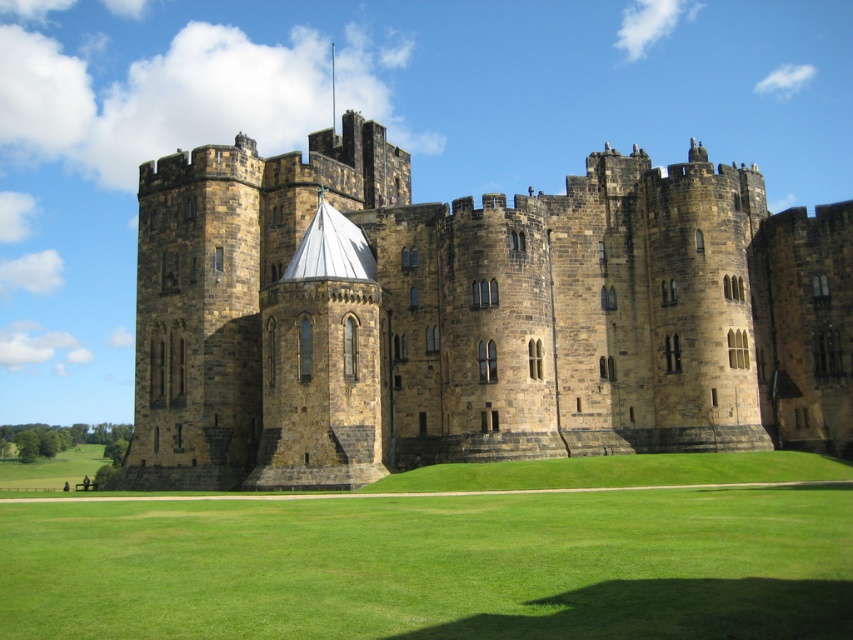
Question: Which of the following is the closest to the observer?

Choices:
 (A) green grass at center
 (B) brown stone castle at center

Answer: (A)

Question: Which point appears closest to the camera in this image?

Choices:
 (A) (231, 540)
 (B) (834, 337)

Answer: (A)

Question: Which point appears closest to the camera in this image?

Choices:
 (A) (434, 208)
 (B) (44, 628)

Answer: (B)

Question: Is brown stone castle at center thinner than green grass at center?

Choices:
 (A) no
 (B) yes

Answer: (A)

Question: Can you confirm if brown stone castle at center is wider than green grass at center?

Choices:
 (A) yes
 (B) no

Answer: (A)

Question: Is brown stone castle at center smaller than green grass at center?

Choices:
 (A) no
 (B) yes

Answer: (A)